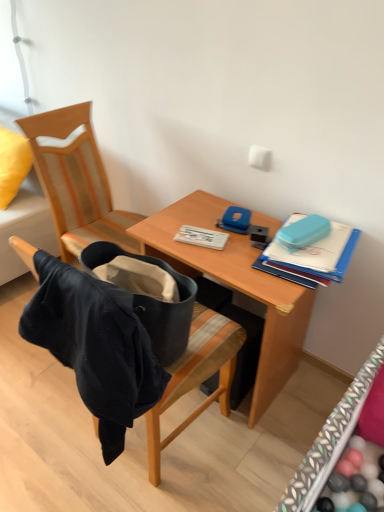
Identify the location of free location to the right of white plastic notebook at center. This screenshot has height=512, width=384. (251, 234).